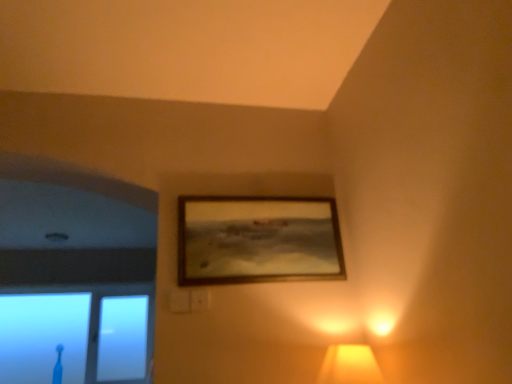
Question: Should I look upward or downward to see matte yellow lampshade at lower right?

Choices:
 (A) down
 (B) up

Answer: (A)

Question: Is matte yellow lampshade at lower right thinner than wooden frame at upper center?

Choices:
 (A) no
 (B) yes

Answer: (A)

Question: Is matte yellow lampshade at lower right facing towards wooden frame at upper center?

Choices:
 (A) no
 (B) yes

Answer: (A)

Question: Can you confirm if matte yellow lampshade at lower right is shorter than wooden frame at upper center?

Choices:
 (A) yes
 (B) no

Answer: (A)

Question: From the image's perspective, is matte yellow lampshade at lower right beneath wooden frame at upper center?

Choices:
 (A) no
 (B) yes

Answer: (B)

Question: Is matte yellow lampshade at lower right beside wooden frame at upper center?

Choices:
 (A) no
 (B) yes

Answer: (A)

Question: Is the depth of matte yellow lampshade at lower right less than that of wooden frame at upper center?

Choices:
 (A) no
 (B) yes

Answer: (B)

Question: Is wooden frame at upper center thinner than transparent glass toothbrush at lower left?

Choices:
 (A) yes
 (B) no

Answer: (A)

Question: Is transparent glass toothbrush at lower left at the back of wooden frame at upper center?

Choices:
 (A) no
 (B) yes

Answer: (B)

Question: Is transparent glass toothbrush at lower left located within wooden frame at upper center?

Choices:
 (A) no
 (B) yes

Answer: (A)

Question: From the image's perspective, is wooden frame at upper center below transparent glass toothbrush at lower left?

Choices:
 (A) no
 (B) yes

Answer: (A)

Question: Is wooden frame at upper center next to transparent glass toothbrush at lower left and touching it?

Choices:
 (A) yes
 (B) no

Answer: (B)

Question: Can you confirm if wooden frame at upper center is wider than transparent glass toothbrush at lower left?

Choices:
 (A) no
 (B) yes

Answer: (A)

Question: Is transparent glass toothbrush at lower left to the left of matte yellow lampshade at lower right from the viewer's perspective?

Choices:
 (A) yes
 (B) no

Answer: (A)